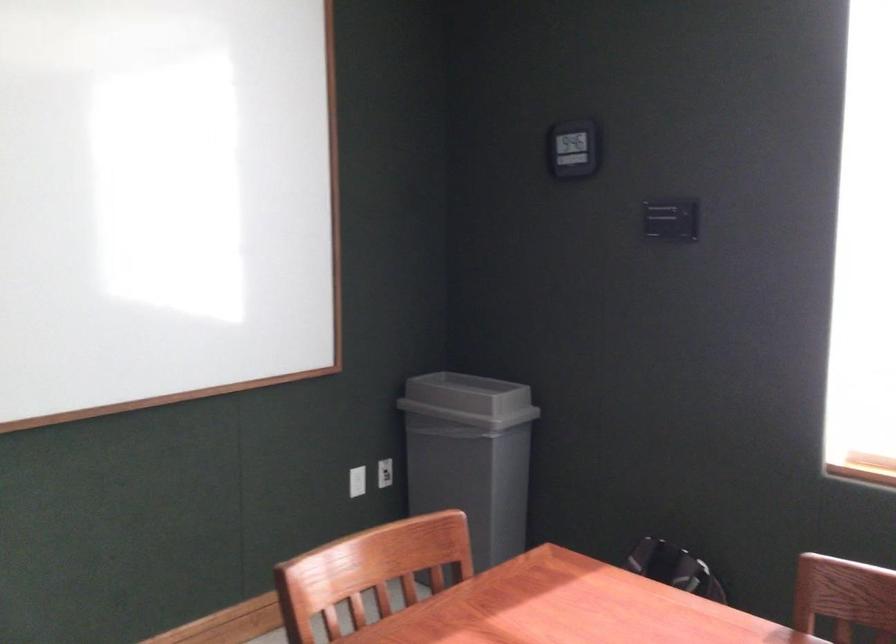
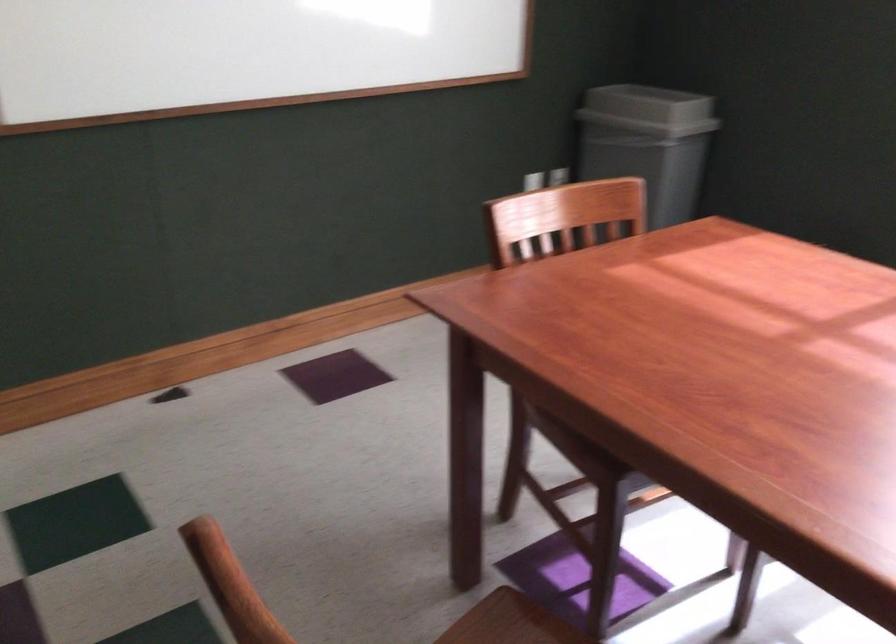
In the second image, find the point that corresponds to pixel 475 404 in the first image.

(648, 109)